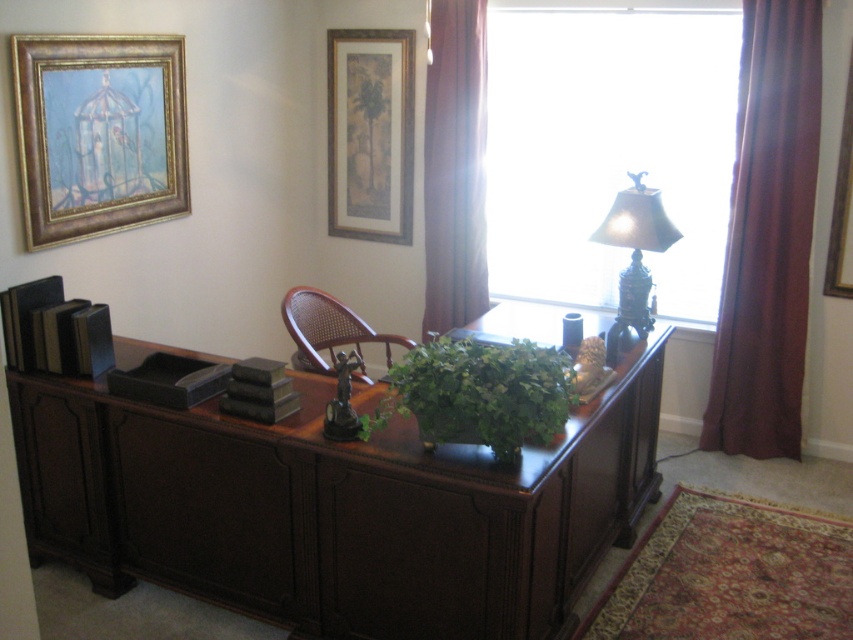
Question: Which object is positioned closest to the metallic gold lamp at upper right?

Choices:
 (A) brown cane chair at center
 (B) gold-framed painting at upper left
 (C) transparent glass window at upper center
 (D) matte gold picture frame at upper center

Answer: (C)

Question: Does brown velvet curtain at upper right have a lesser width compared to matte gold picture frame at upper center?

Choices:
 (A) yes
 (B) no

Answer: (A)

Question: Is brown cane chair at center further to camera compared to wooden picture frame at upper right?

Choices:
 (A) yes
 (B) no

Answer: (B)

Question: Does gold-framed painting at upper left have a larger size compared to brown velvet curtain at upper right?

Choices:
 (A) no
 (B) yes

Answer: (B)

Question: Which object is positioned closest to the brown velvet curtain at upper right?

Choices:
 (A) brown fabric curtain at right
 (B) gold-framed painting at upper left

Answer: (A)

Question: Considering the real-world distances, which object is farthest from the dark wood desk at center?

Choices:
 (A) wooden picture frame at upper right
 (B) metallic gold lamp at upper right

Answer: (A)